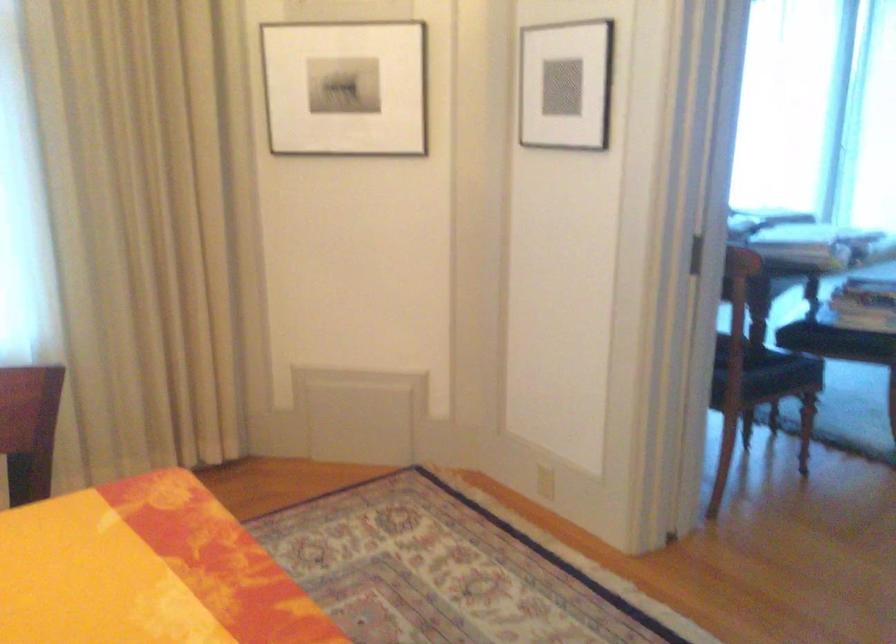
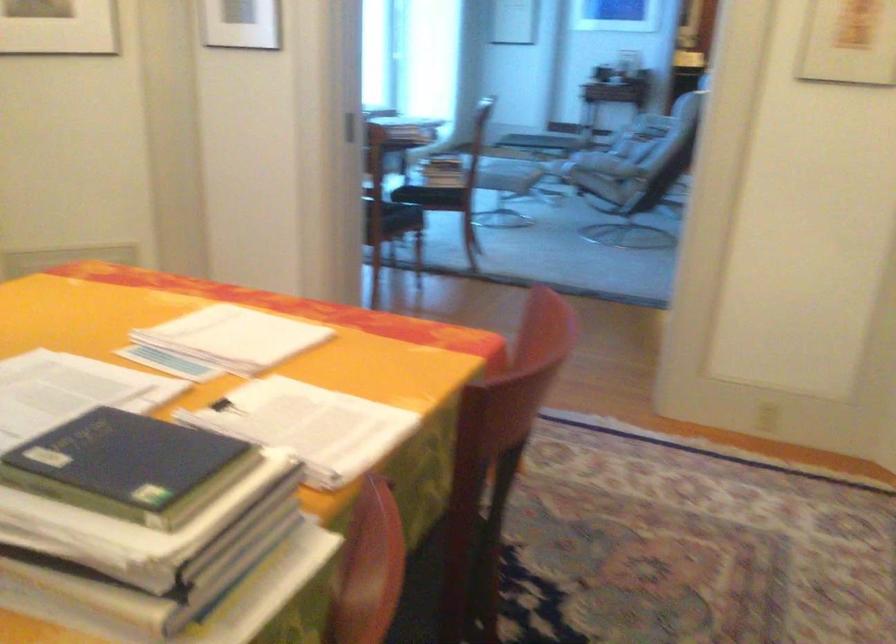
Question: Based on the continuous images, in which direction is the camera rotating? Reply with the corresponding letter.

Choices:
 (A) Left
 (B) Right
 (C) Up
 (D) Down

Answer: (B)